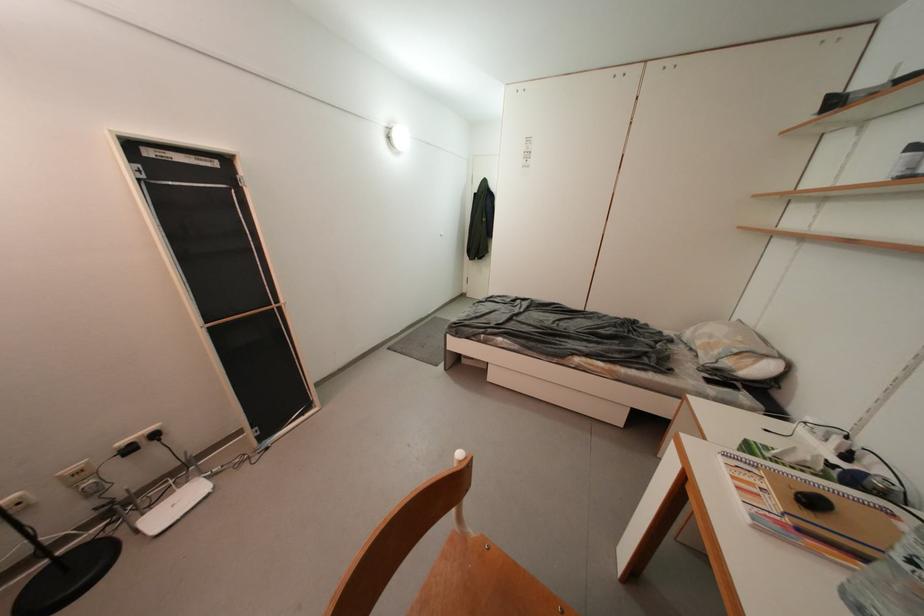
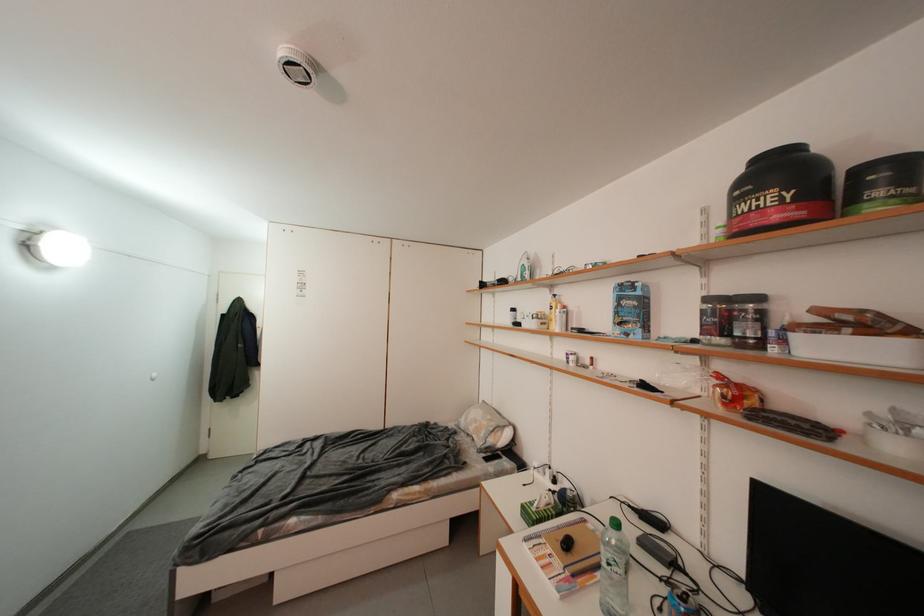
Where in the second image is the point corresponding to point 754,446 from the first image?

(530, 509)